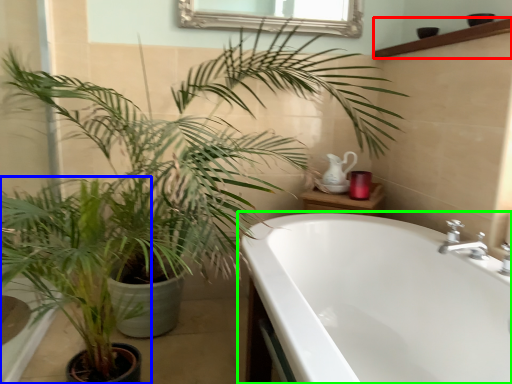
Question: Which object is the farthest from balustrade (highlighted by a red box)? Choose among these: houseplant (highlighted by a blue box) or bathtub (highlighted by a green box).

Choices:
 (A) houseplant
 (B) bathtub

Answer: (A)